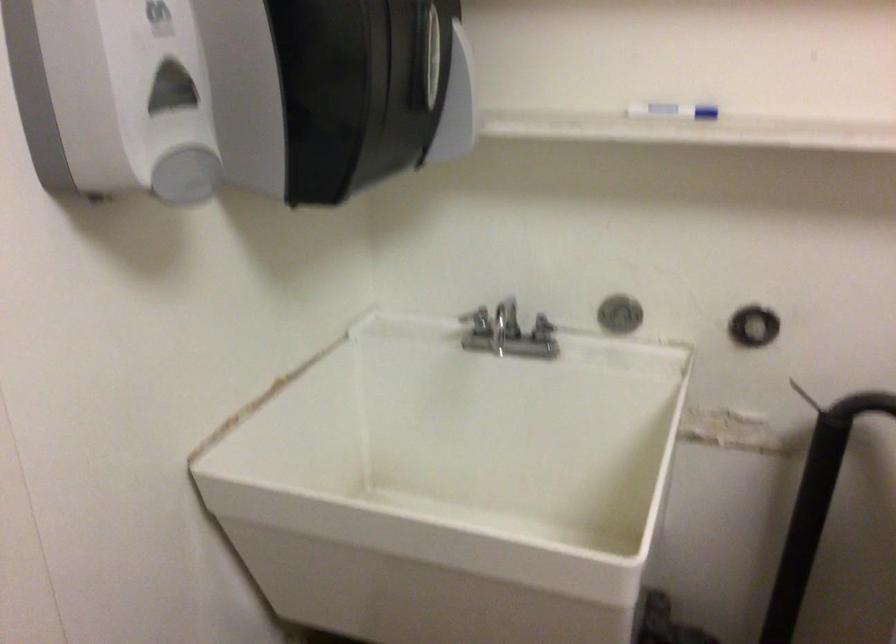
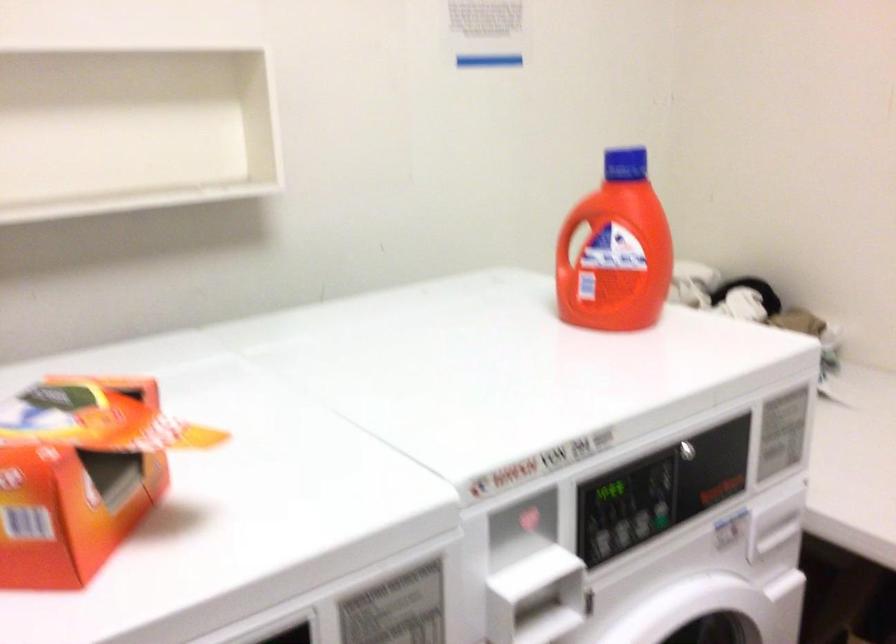
Question: The first image is from the beginning of the video and the second image is from the end. How did the camera likely rotate when shooting the video?

Choices:
 (A) Left
 (B) Right
 (C) Up
 (D) Down

Answer: (B)